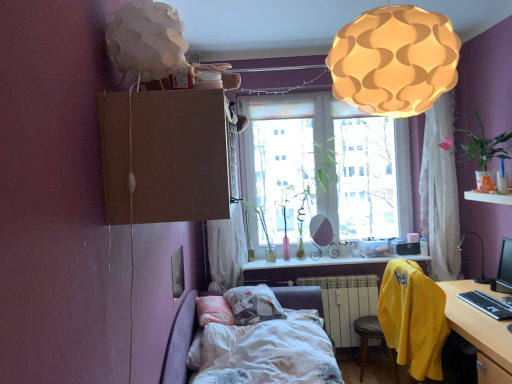
The height and width of the screenshot is (384, 512). I want to click on vacant area on top of white painted metal radiator at lower center (from a real-world perspective), so point(328,271).